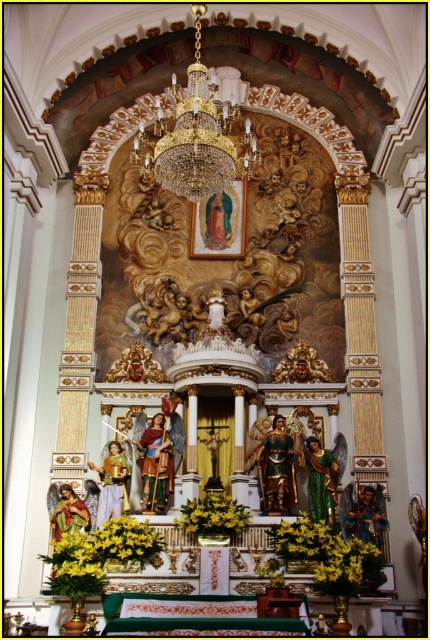
Question: Which point is closer to the camera?

Choices:
 (A) yellow fabric flower at center
 (B) yellow fabric flowers at lower left
 (C) yellow matte flowers at center

Answer: (B)

Question: Does yellow fabric flowers at lower left have a greater width compared to yellow matte flowers at center?

Choices:
 (A) yes
 (B) no

Answer: (A)

Question: Which point is farther to the camera?

Choices:
 (A) yellow fabric flower at center
 (B) yellow matte flowers at center

Answer: (A)

Question: Is yellow matte flowers at center to the right of yellow fabric flower at center from the viewer's perspective?

Choices:
 (A) yes
 (B) no

Answer: (A)

Question: Which object is positioned farthest from the yellow fabric flowers at lower left?

Choices:
 (A) yellow fabric flower at center
 (B) yellow matte flowers at center

Answer: (B)

Question: Is yellow fabric flowers at lower left above yellow fabric flower at center?

Choices:
 (A) yes
 (B) no

Answer: (B)